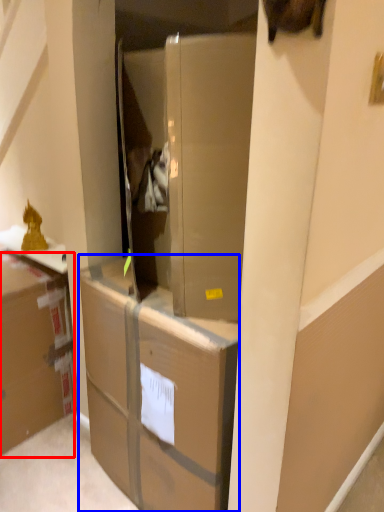
Question: Which point is closer to the camera, cardboard box (highlighted by a red box) or cabinetry (highlighted by a blue box)?

Choices:
 (A) cardboard box
 (B) cabinetry

Answer: (B)